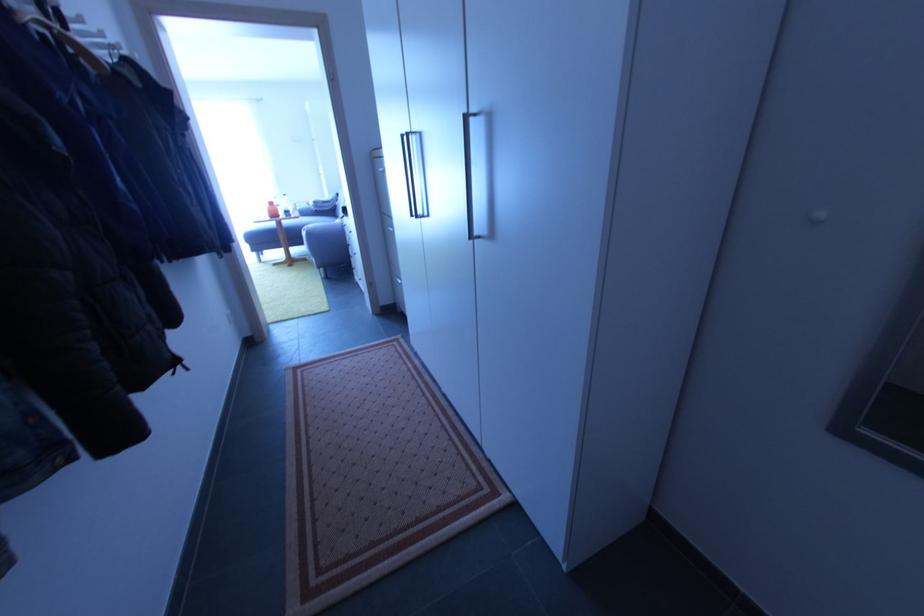
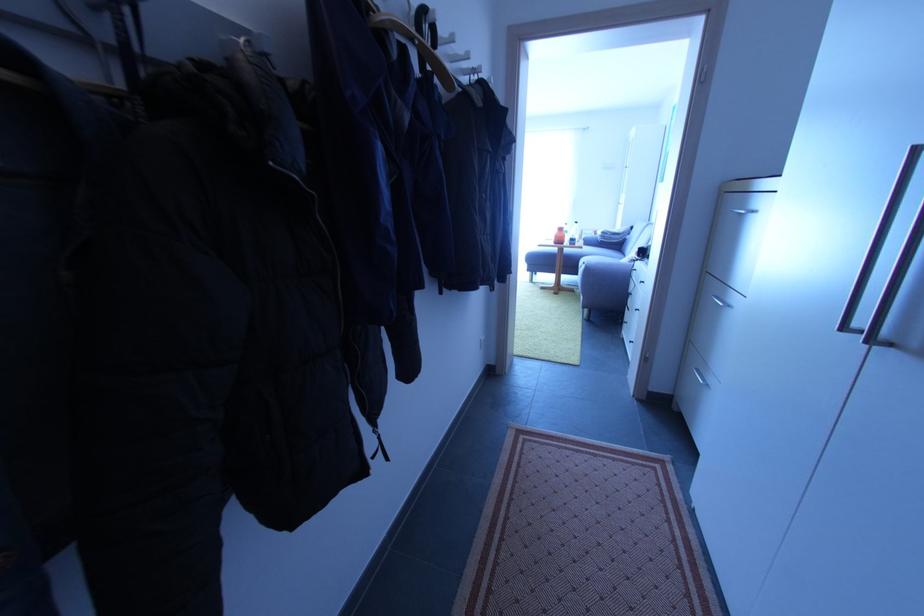
Where in the second image is the point corresponding to (x=405, y=284) from the first image?

(706, 383)